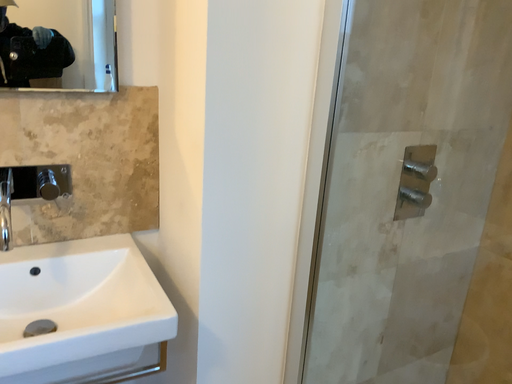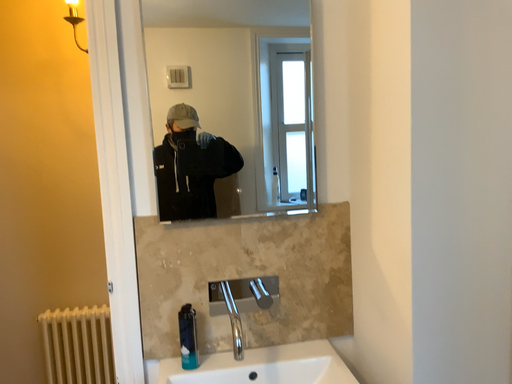
Question: How did the camera likely rotate when shooting the video?

Choices:
 (A) rotated left
 (B) rotated right

Answer: (A)